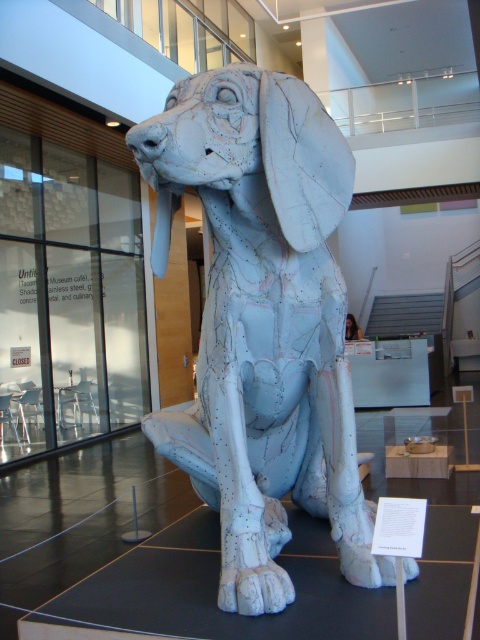
You are an art curator standing in front of the sculpture. You want to place a small plaque describing the white matte tusk at center. Where should you place the plaque relative to the white matte sculpture at center?

The white matte sculpture at center is to the right of the white matte tusk at center, so the plaque for the white matte tusk at center should be placed to the left of the white matte sculpture at center.

You are an art curator planning to display both the white matte sculpture at center and the white matte tusk at center in a narrow hallway. Given their sizes, which object should be placed first to ensure they both fit without overlapping?

The white matte sculpture at center should be placed first since it has a larger width than the white matte tusk at center, allowing it to occupy more space initially so both can fit without overlapping.